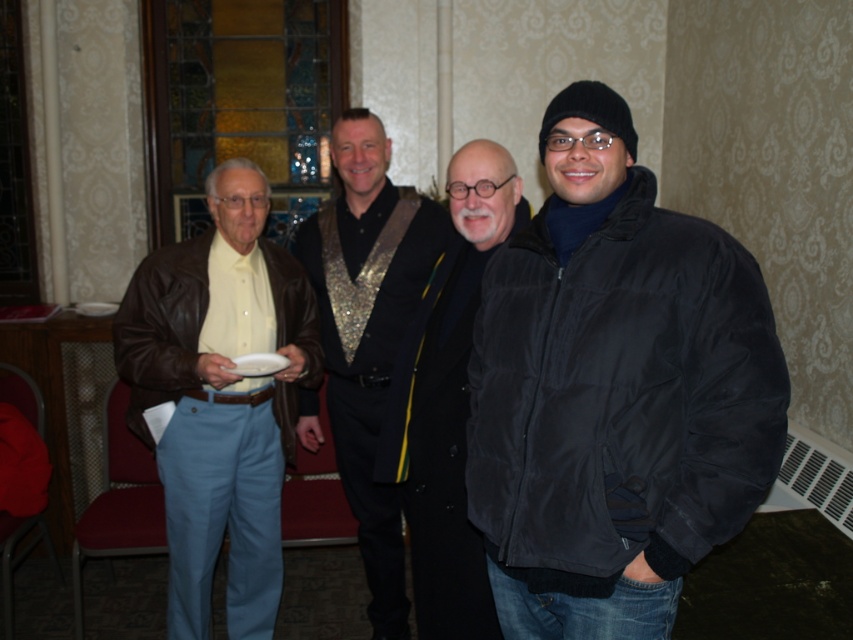
Can you confirm if black puffy jacket at right is smaller than matte brown leather jacket at left?

Yes.

Can you confirm if black puffy jacket at right is thinner than matte brown leather jacket at left?

Correct, black puffy jacket at right's width is less than matte brown leather jacket at left's.

Identify the location of black puffy jacket at right. The image size is (853, 640). (614, 392).

Where is `black matte jacket at center`? This screenshot has height=640, width=853. black matte jacket at center is located at coordinates (454, 401).

Measure the distance between black matte jacket at center and camera.

6.25 feet

Locate an element on the screen. The image size is (853, 640). black matte jacket at center is located at coordinates (454, 401).

From the picture: Who is shorter, black puffy jacket at right or black matte jacket at center?

Standing shorter between the two is black puffy jacket at right.

Does black puffy jacket at right appear on the left side of black matte jacket at center?

No, black puffy jacket at right is not to the left of black matte jacket at center.

Is point (532, 500) more distant than point (419, 529)?

No.

Where is `black puffy jacket at right`? The height and width of the screenshot is (640, 853). black puffy jacket at right is located at coordinates (614, 392).